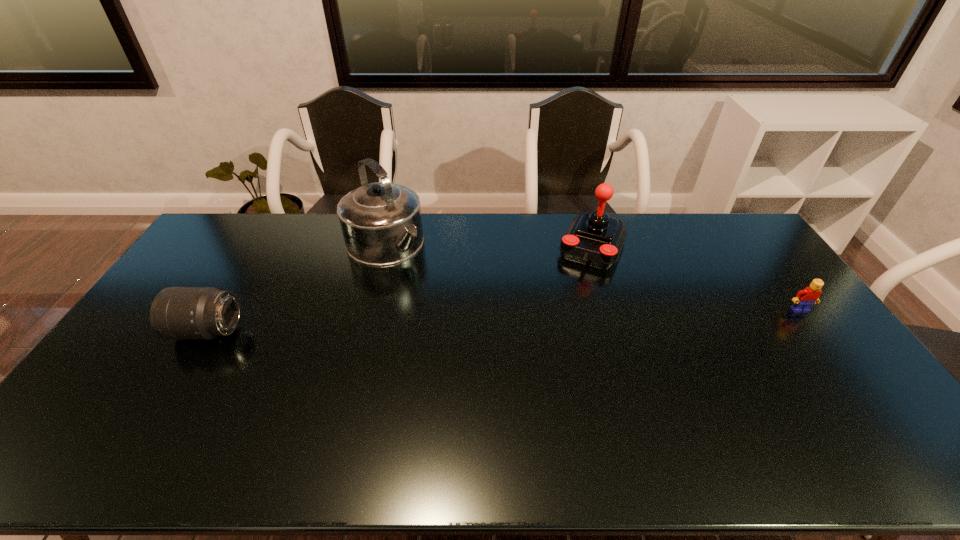
Identify the location of free space on the desktop that is between the leftmost object and the Lego and is positioned with the spout at the front of the third object from right to left. The width and height of the screenshot is (960, 540). (468, 322).

In order to click on free space on the desktop that is between the telephoto lens and the Lego and is positioned on the base of the joystick in this screenshot , I will do `click(560, 319)`.